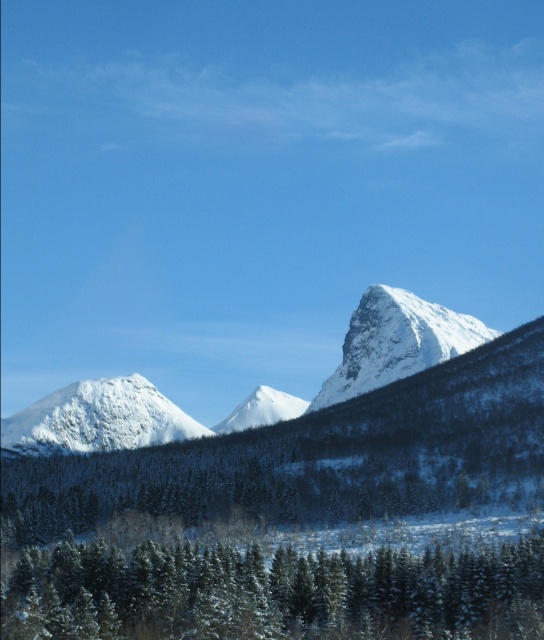
Between snowy evergreen trees at center and white snow-covered mountain at left, which one has more height?

white snow-covered mountain at left

Which is behind, point (137, 628) or point (52, 451)?

The point (52, 451) is behind.

Image resolution: width=544 pixels, height=640 pixels. What do you see at coordinates (274, 593) in the screenshot? I see `snowy evergreen trees at center` at bounding box center [274, 593].

Find the location of a particular element. snowy evergreen trees at center is located at coordinates (274, 593).

Does snowy evergreen trees at center appear on the left side of white snow-covered peak at center?

Correct, you'll find snowy evergreen trees at center to the left of white snow-covered peak at center.

Measure the distance between snowy evergreen trees at center and camera.

107.42 meters

The image size is (544, 640). Describe the element at coordinates (274, 593) in the screenshot. I see `snowy evergreen trees at center` at that location.

Identify the location of snowy evergreen trees at center. This screenshot has height=640, width=544. (274, 593).

Based on the photo, is white snow-covered peak at center smaller than white snow-covered mountain at center?

No.

This screenshot has height=640, width=544. What are the coordinates of `white snow-covered peak at center` in the screenshot? It's located at (397, 342).